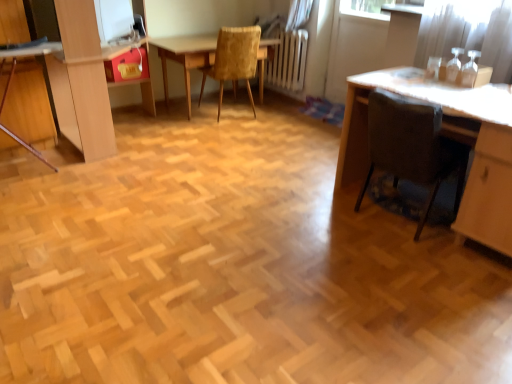
You are a GUI agent. You are given a task and a screenshot of the screen. Output one action in this format:
    pyautogui.click(x=<x>, y=<y>)
    Task: Click on the free space in front of matte wooden dresser at left
    
    Given the screenshot: What is the action you would take?
    pyautogui.click(x=106, y=177)